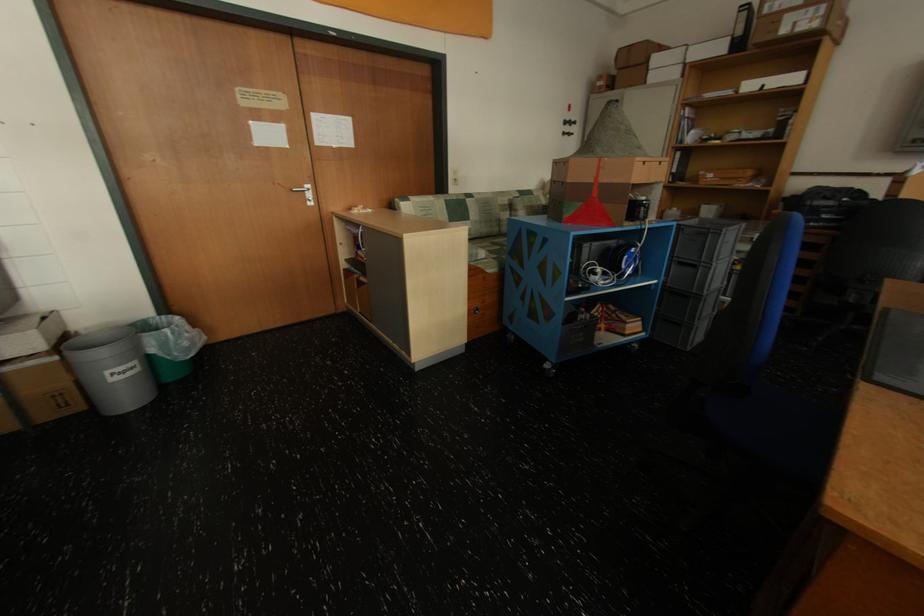
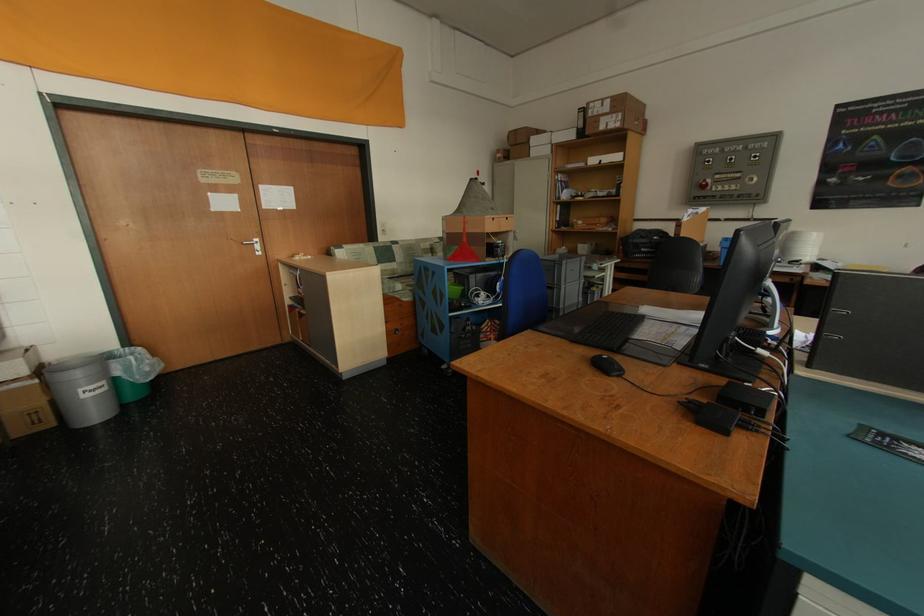
Locate, in the second image, the point that corresponds to the point at 78,405 in the first image.

(50, 422)